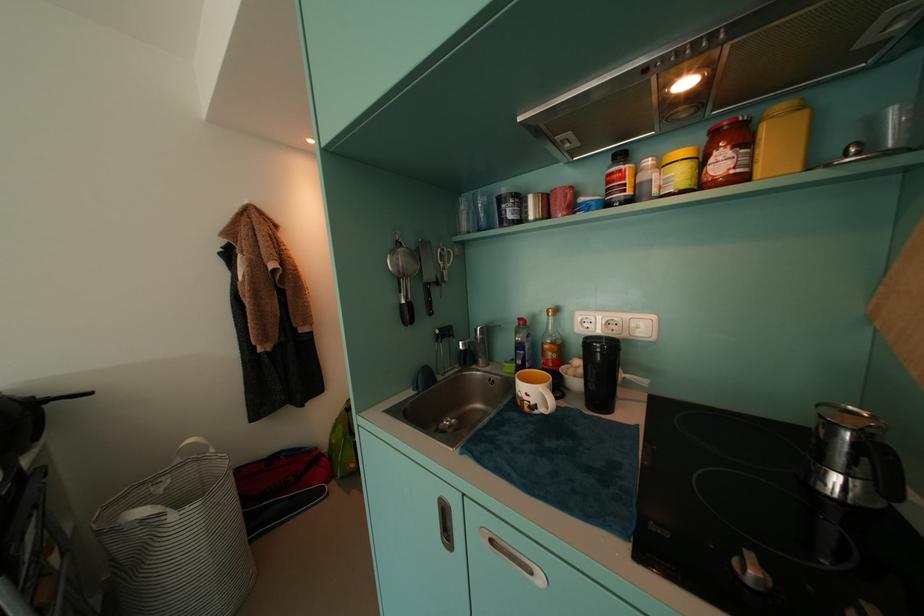
Find where to push the white power switch. Please return your answer as a coordinate pair (x, y).

(634, 325)